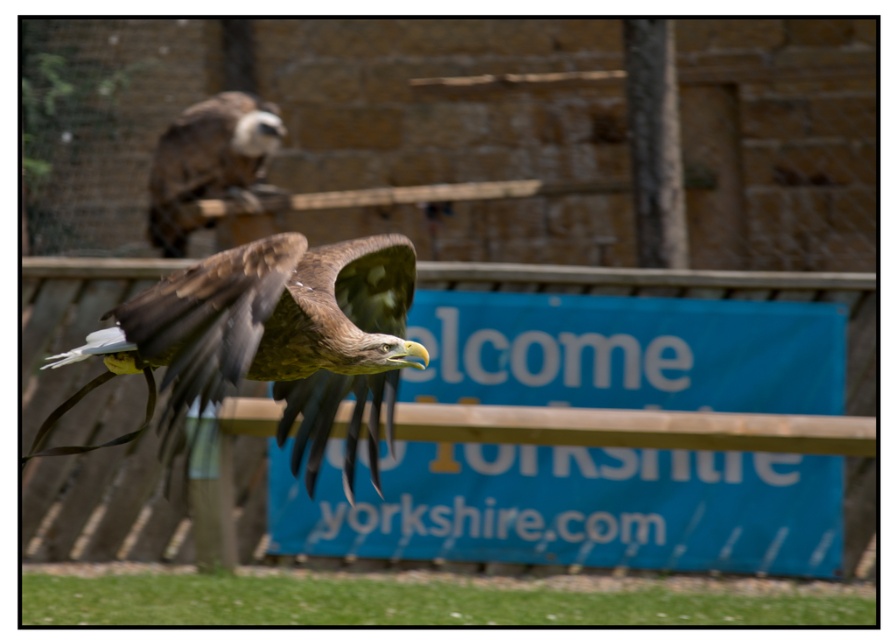
Does brown feathered eagle at center have a lesser width compared to brown feathered eagle at upper center?

In fact, brown feathered eagle at center might be wider than brown feathered eagle at upper center.

Find the location of `brown feathered eagle at center`. brown feathered eagle at center is located at coordinates (269, 337).

You are a GUI agent. You are given a task and a screenshot of the screen. Output one action in this format:
    pyautogui.click(x=<x>, y=<y>)
    Task: Click on the brown feathered eagle at center
    This screenshot has width=896, height=640.
    Given the screenshot: What is the action you would take?
    pyautogui.click(x=269, y=337)

You are a GUI agent. You are given a task and a screenshot of the screen. Output one action in this format:
    pyautogui.click(x=<x>, y=<y>)
    Task: Click on the brown feathered eagle at center
    Image resolution: width=896 pixels, height=640 pixels.
    Given the screenshot: What is the action you would take?
    pyautogui.click(x=269, y=337)